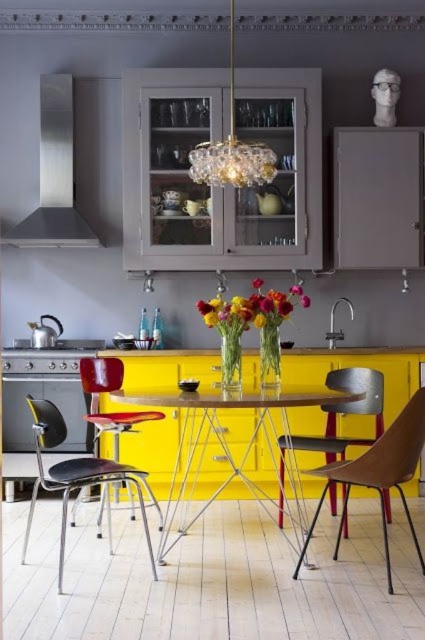
Is point (241, 480) in front of point (82, 376)?

No.

Does yellow glossy table at center lie in front of metallic red chair at left?

Yes.

The width and height of the screenshot is (425, 640). Describe the element at coordinates (229, 448) in the screenshot. I see `yellow glossy table at center` at that location.

Locate an element on the screen. The image size is (425, 640). yellow glossy table at center is located at coordinates (229, 448).

Can you confirm if stainless steel oven at left is taller than crystal chandelier at upper center?

Incorrect, stainless steel oven at left's height is not larger of crystal chandelier at upper center's.

Can you confirm if stainless steel oven at left is positioned to the right of crystal chandelier at upper center?

No, stainless steel oven at left is not to the right of crystal chandelier at upper center.

Does point (37, 381) come closer to viewer compared to point (206, 179)?

No.

At what (x,y) coordinates should I click in order to perform the action: click on stainless steel oven at left. Please return your answer as a coordinate pair (x, y). Looking at the image, I should click on (44, 394).

Does glossy glass vase at center appear on the right side of glossy floral bouquet at center?

Incorrect, glossy glass vase at center is not on the right side of glossy floral bouquet at center.

Is glossy glass vase at center shorter than glossy floral bouquet at center?

No, glossy glass vase at center is not shorter than glossy floral bouquet at center.

Identify the location of glossy glass vase at center. Image resolution: width=425 pixels, height=640 pixels. click(252, 308).

Identify the location of glossy glass vase at center. The height and width of the screenshot is (640, 425). (252, 308).